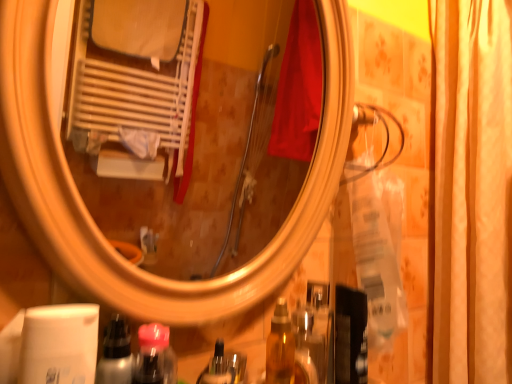
Question: Which is correct: translucent plastic bottle at lower center is inside silky beige curtain at right, or outside of it?

Choices:
 (A) outside
 (B) inside

Answer: (A)

Question: Considering the positions of translucent plastic bottle at lower center and silky beige curtain at right in the image, is translucent plastic bottle at lower center taller or shorter than silky beige curtain at right?

Choices:
 (A) short
 (B) tall

Answer: (A)

Question: Which is farther from the metallic silver spray at lower left?

Choices:
 (A) silky beige curtain at right
 (B) translucent plastic bottle at lower center

Answer: (A)

Question: Which object is the farthest from the translucent plastic bottle at lower center?

Choices:
 (A) metallic silver spray at lower left
 (B) silky beige curtain at right

Answer: (B)